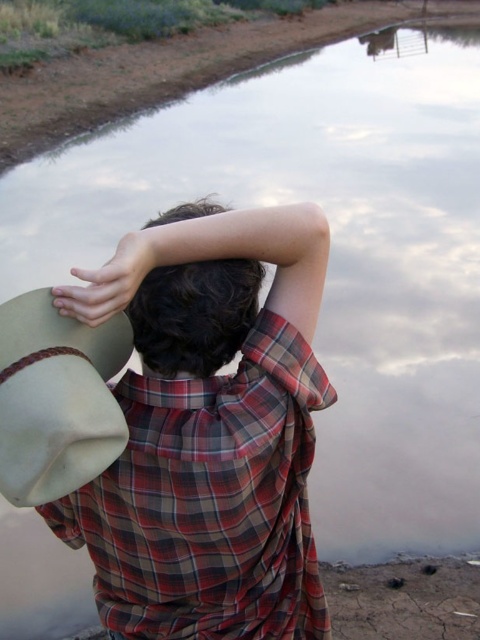
Question: Which of the following is the farthest from the observer?

Choices:
 (A) (108, 563)
 (B) (158, 237)
 (C) (97, 419)

Answer: (A)

Question: Does dark brown hair at center have a greater width compared to matte beige hat at upper left?

Choices:
 (A) no
 (B) yes

Answer: (A)

Question: Is plaid cotton shirt at back positioned at the back of dark brown hair at center?

Choices:
 (A) no
 (B) yes

Answer: (B)

Question: Which of the following is the closest to the observer?

Choices:
 (A) 86,394
 (B) 135,323
 (C) 136,490
 (D) 123,243

Answer: (D)

Question: Which point appears farthest from the camera in this image?

Choices:
 (A) (184, 268)
 (B) (80, 392)

Answer: (A)

Question: Is plaid cotton shirt at back bigger than matte beige hat at upper left?

Choices:
 (A) no
 (B) yes

Answer: (B)